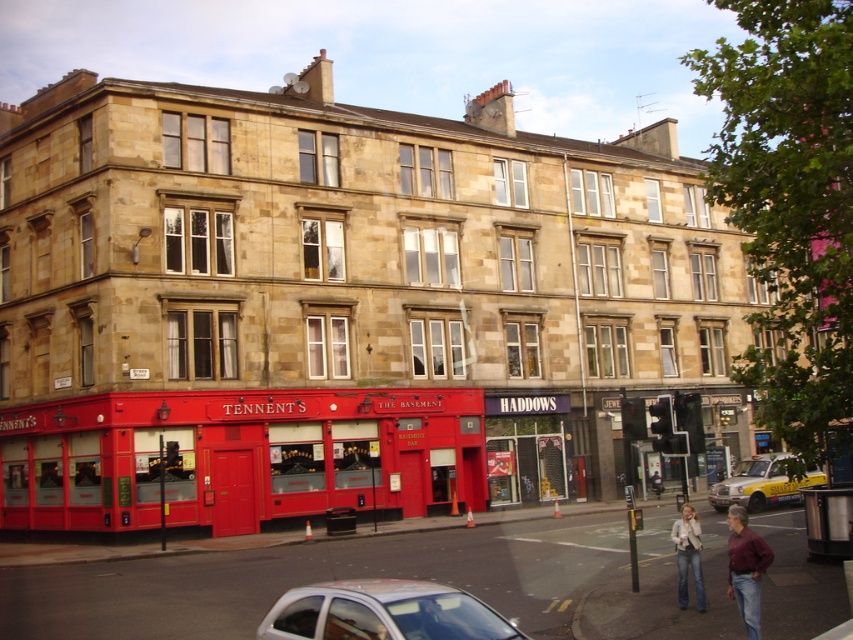
You are a pedestrian standing at the street corner and want to cross the road. There is a red painted bus at lower center and a white glossy car at lower center. Which vehicle should you avoid stepping on because it is bigger?

The red painted bus at lower center is larger in size than the white glossy car at lower center. Therefore, you should avoid stepping on the red painted bus at lower center as it is bigger.